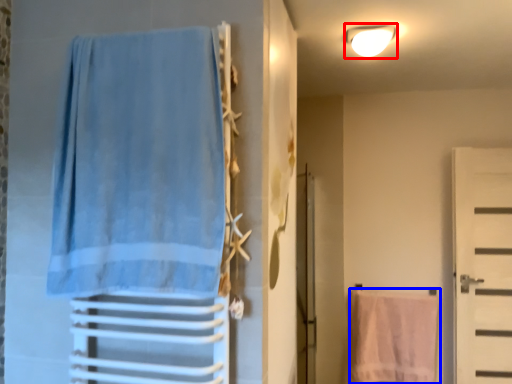
Question: Which object is further to the camera taking this photo, light fixture (highlighted by a red box) or beach towel (highlighted by a blue box)?

Choices:
 (A) light fixture
 (B) beach towel

Answer: (B)